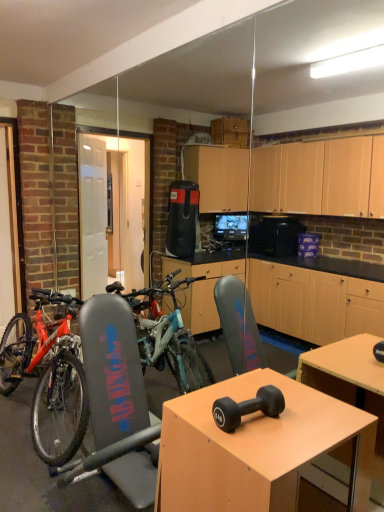
Find the location of a particular element. The image size is (384, 512). spots to the right of black rubber dumbbell at center is located at coordinates (302, 420).